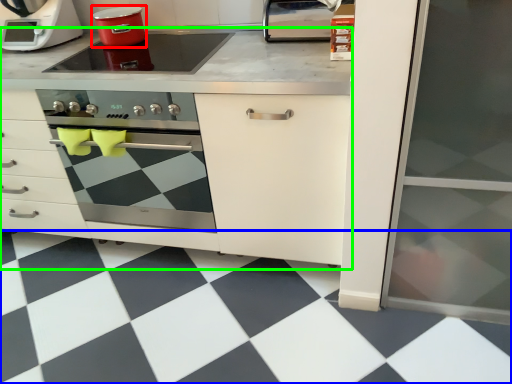
Question: Which object is positioned farthest from kitchen appliance (highlighted by a red box)? Select from tile (highlighted by a blue box) and cabinetry (highlighted by a green box).

Choices:
 (A) tile
 (B) cabinetry

Answer: (A)